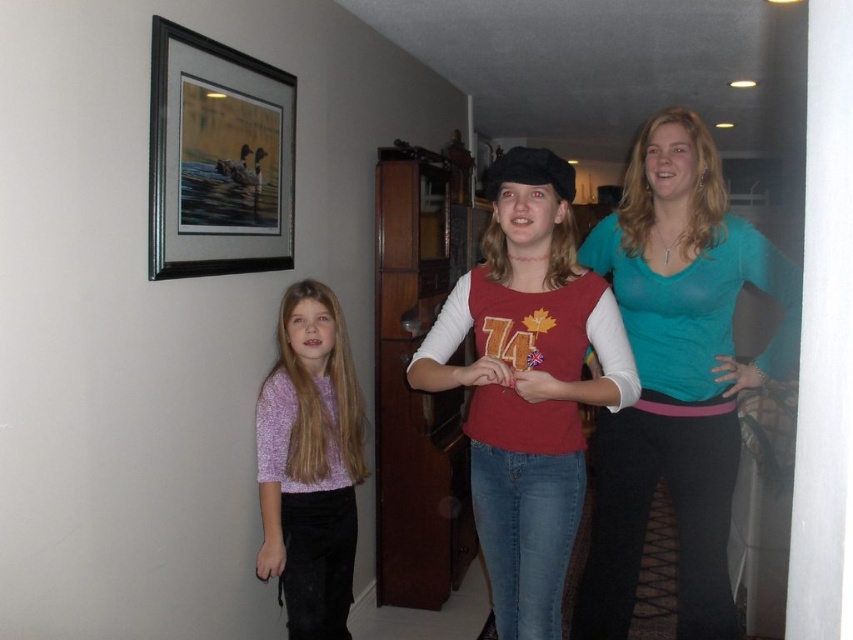
Who is more distant from viewer, (549, 525) or (274, 168)?

Point (274, 168)

Does matte red shirt at center appear on the right side of black framed picture at upper left?

Yes, matte red shirt at center is to the right of black framed picture at upper left.

Find the location of `matte red shirt at center`. matte red shirt at center is located at coordinates coord(527,384).

Where is `matte red shirt at center`? The image size is (853, 640). matte red shirt at center is located at coordinates (527, 384).

Which is below, black framed picture at upper left or purple knit sweater at left?

purple knit sweater at left is lower down.

Is point (229, 179) positioned after point (340, 332)?

No, it is not.

Between point (262, 104) and point (317, 419), which one is positioned behind?

The point (262, 104) is more distant.

This screenshot has width=853, height=640. I want to click on black framed picture at upper left, so click(218, 157).

Is teal jersey at center below black framed picture at upper left?

Indeed, teal jersey at center is positioned under black framed picture at upper left.

Is teal jersey at center positioned in front of black framed picture at upper left?

No, it is not.

Is point (645, 483) positioned after point (177, 148)?

Yes, point (645, 483) is farther from viewer.

This screenshot has width=853, height=640. Identify the location of teal jersey at center. (676, 376).